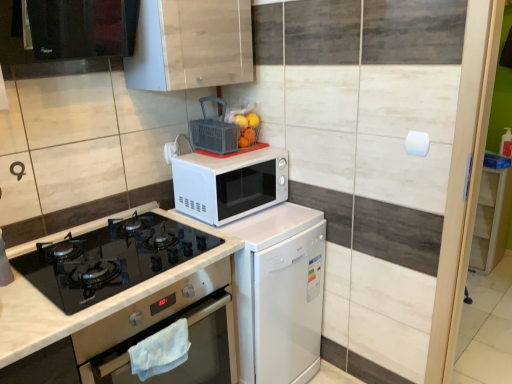
Question: Is the depth of white matte microwave at center, which appears as the second appliance when viewed from the right, greater than that of white matte microwave at center?

Choices:
 (A) yes
 (B) no

Answer: (A)

Question: From a real-world perspective, does white matte microwave at center, which appears as the second appliance when viewed from the right, sit lower than white matte microwave at center?

Choices:
 (A) yes
 (B) no

Answer: (B)

Question: Considering the relative sizes of white matte microwave at center, which appears as the second appliance when viewed from the right, and white matte microwave at center in the image provided, is white matte microwave at center, which appears as the second appliance when viewed from the right, thinner than white matte microwave at center?

Choices:
 (A) yes
 (B) no

Answer: (A)

Question: Does white matte microwave at center, which ranks as the 1th appliance in left-to-right order, have a smaller size compared to white matte microwave at center?

Choices:
 (A) no
 (B) yes

Answer: (B)

Question: Can you confirm if white matte microwave at center, which appears as the second appliance when viewed from the right, is bigger than white matte microwave at center?

Choices:
 (A) yes
 (B) no

Answer: (B)

Question: Considering the relative positions of black glass exhaust hood at upper left and white marble countertop at lower left in the image provided, is black glass exhaust hood at upper left to the left of white marble countertop at lower left from the viewer's perspective?

Choices:
 (A) yes
 (B) no

Answer: (A)

Question: Considering the relative sizes of black glass exhaust hood at upper left and white marble countertop at lower left in the image provided, is black glass exhaust hood at upper left thinner than white marble countertop at lower left?

Choices:
 (A) yes
 (B) no

Answer: (A)

Question: Could white marble countertop at lower left be considered to be inside black glass exhaust hood at upper left?

Choices:
 (A) no
 (B) yes

Answer: (A)

Question: Considering the relative positions of black glass exhaust hood at upper left and white marble countertop at lower left in the image provided, is black glass exhaust hood at upper left behind white marble countertop at lower left?

Choices:
 (A) no
 (B) yes

Answer: (B)

Question: Is black glass exhaust hood at upper left facing towards white marble countertop at lower left?

Choices:
 (A) no
 (B) yes

Answer: (A)

Question: Does black glass exhaust hood at upper left have a greater height compared to white marble countertop at lower left?

Choices:
 (A) yes
 (B) no

Answer: (B)

Question: Can you confirm if white glossy dishwasher at center is bigger than matte plastic basket at upper center, the first appliance in the right-to-left sequence?

Choices:
 (A) no
 (B) yes

Answer: (B)